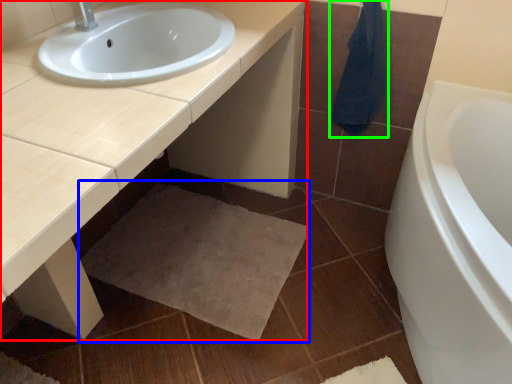
Question: Which object is positioned farthest from countertop (highlighted by a red box)? Select from bath mat (highlighted by a blue box) and bath towel (highlighted by a green box).

Choices:
 (A) bath mat
 (B) bath towel

Answer: (A)